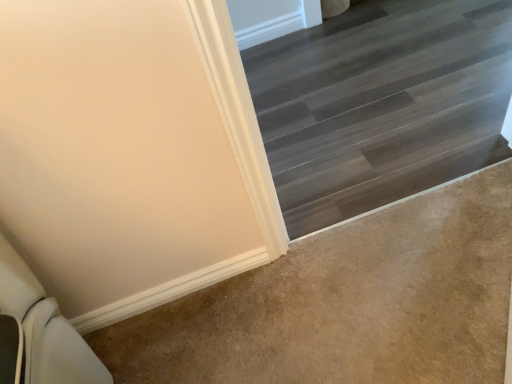
Question: Choose the correct answer: Is beige carpet at lower right inside dark wood stairs at upper right or outside it?

Choices:
 (A) outside
 (B) inside

Answer: (A)

Question: Based on their sizes in the image, would you say beige carpet at lower right is bigger or smaller than dark wood stairs at upper right?

Choices:
 (A) big
 (B) small

Answer: (B)

Question: Is point (207, 357) positioned closer to the camera than point (439, 104)?

Choices:
 (A) closer
 (B) farther

Answer: (A)

Question: Is dark wood stairs at upper right in front of or behind beige carpet at lower right in the image?

Choices:
 (A) front
 (B) behind

Answer: (B)

Question: Would you say dark wood stairs at upper right is to the left or to the right of beige carpet at lower right in the picture?

Choices:
 (A) left
 (B) right

Answer: (B)

Question: Do you think dark wood stairs at upper right is within beige carpet at lower right, or outside of it?

Choices:
 (A) inside
 (B) outside

Answer: (B)

Question: Considering the positions of dark wood stairs at upper right and beige carpet at lower right in the image, is dark wood stairs at upper right bigger or smaller than beige carpet at lower right?

Choices:
 (A) small
 (B) big

Answer: (B)